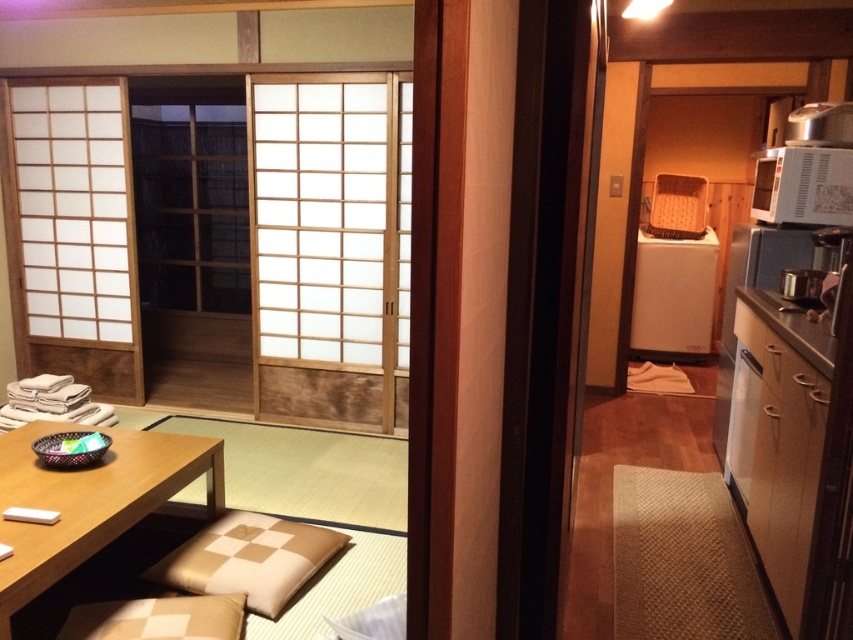
In the scene shown: You are standing in the Japanese room and looking towards the kitchen area. There are two points marked in the image, point at (19, 564) and point at (257, 554). Which point is closer to you?

Point at (19, 564) is closer to you than point at (257, 554).

You are standing in the traditional Japanese room and want to place a beige checkered pillow exactly at the point marked as point (248, 560). Where should you place it?

The beige checkered pillow at lower center is located at point (248, 560).